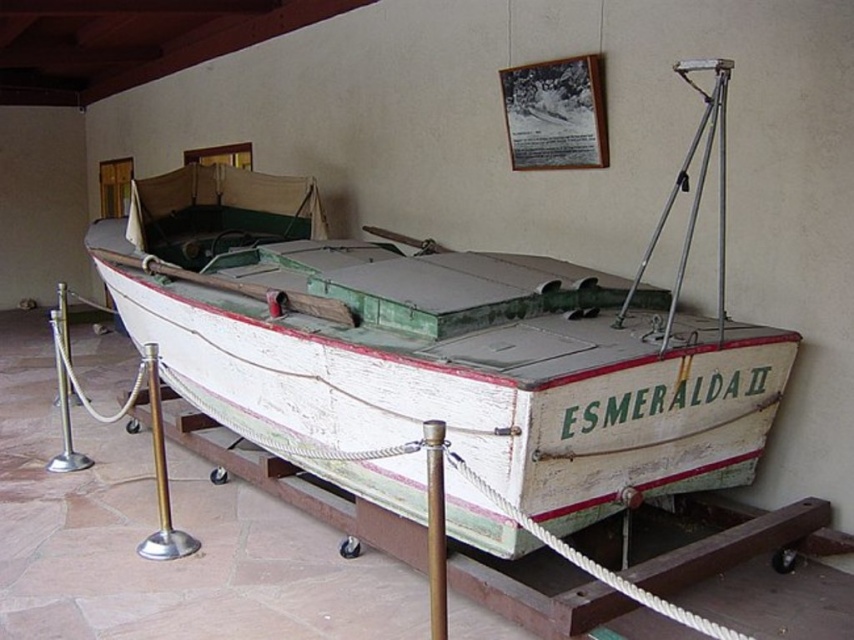
You are standing in a museum and want to take a close look at the white wooden boat at center. If you walk forward 5 feet, will you be within 6 feet of the boat?

The white wooden boat at center is 10.18 feet away from the camera. After walking 5 feet forward, you will be 5.18 feet away from the boat, which is within the 6 feet distance.

You are an interior designer planning to move the white wooden boat at center and the metallic silver frame at upper center to another room. The new room has a narrow doorway that only allows objects to pass through if they are not wider than 1.2 meters. Can both objects fit through the doorway individually?

The white wooden boat at center is positioned on the left side of metallic silver frame at upper center, but the description does not provide their individual widths. Therefore, it is impossible to determine if they can fit through the doorway based on the given information.